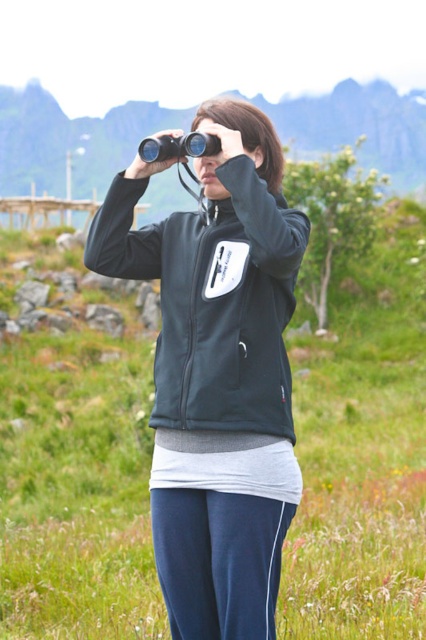
Can you confirm if matte black sweatshirt at center is taller than green grass at center?

In fact, matte black sweatshirt at center may be shorter than green grass at center.

Which is behind, point (255, 429) or point (46, 152)?

Point (46, 152)

Where is `matte black sweatshirt at center`? matte black sweatshirt at center is located at coordinates (213, 300).